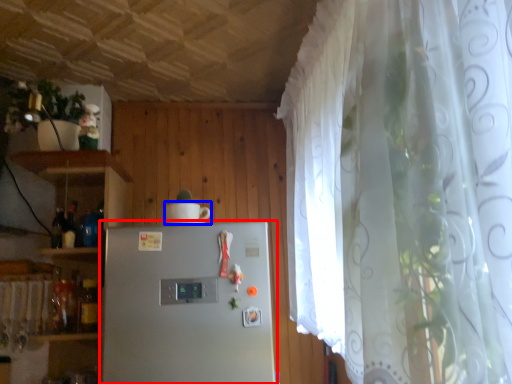
Question: Which object is closer to the camera taking this photo, refrigerator (highlighted by a red box) or appliance (highlighted by a blue box)?

Choices:
 (A) refrigerator
 (B) appliance

Answer: (A)